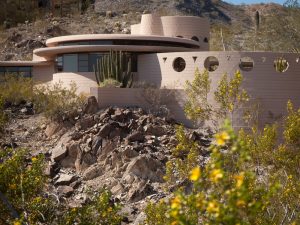
Find the location of a particular element. The image size is (300, 225). glass is located at coordinates (58, 61), (86, 64), (20, 67), (14, 68), (15, 73), (24, 72), (95, 62), (85, 56), (83, 68).